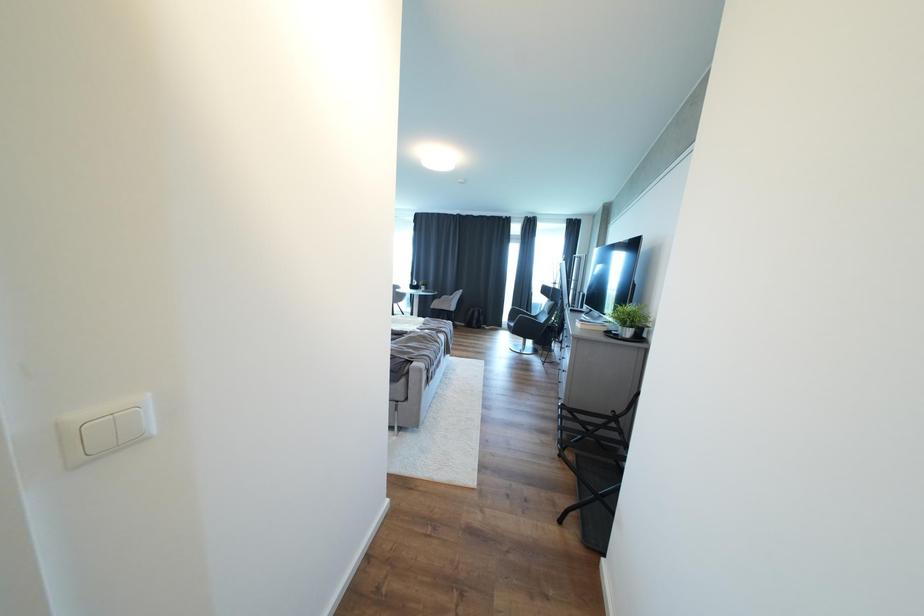
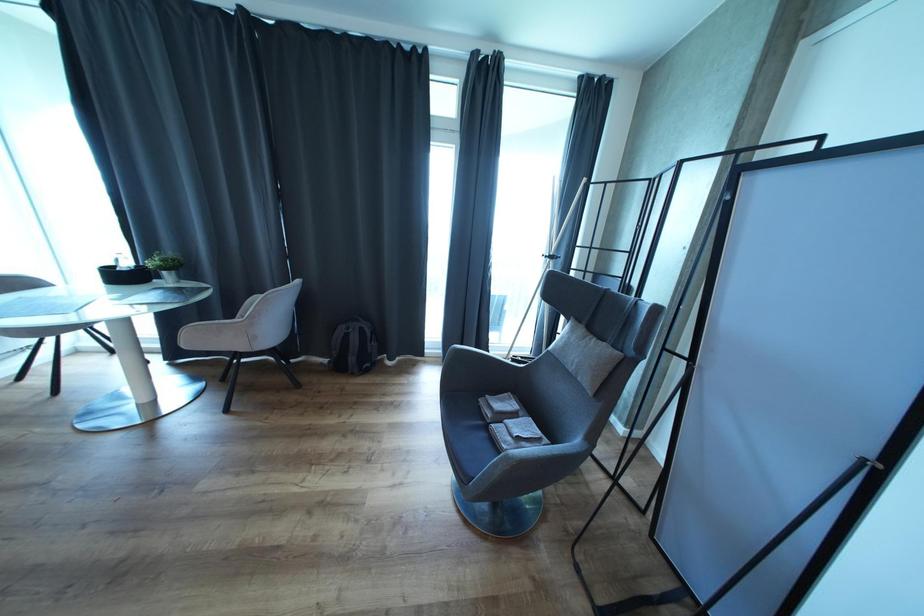
Question: Which direction would the cameraman need to move to produce the second image? Reply with the corresponding letter.

Choices:
 (A) Left
 (B) Right
 (C) Forward
 (D) Backward

Answer: (C)